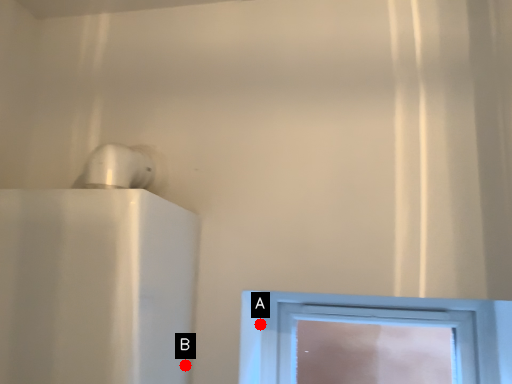
Question: Two points are circled on the image, labeled by A and B beside each circle. Among these points, which one is farthest from the camera?

Choices:
 (A) A is further
 (B) B is further

Answer: (A)